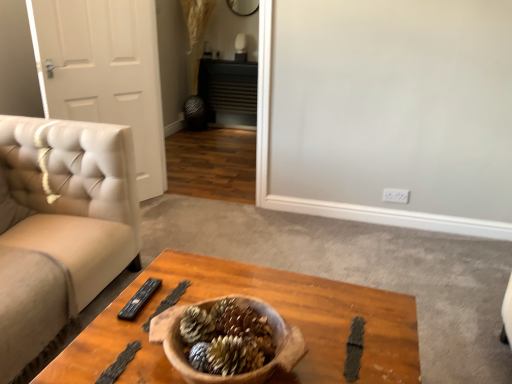
Where is `vacant space behind black plastic remote at center`? vacant space behind black plastic remote at center is located at coordinates (166, 268).